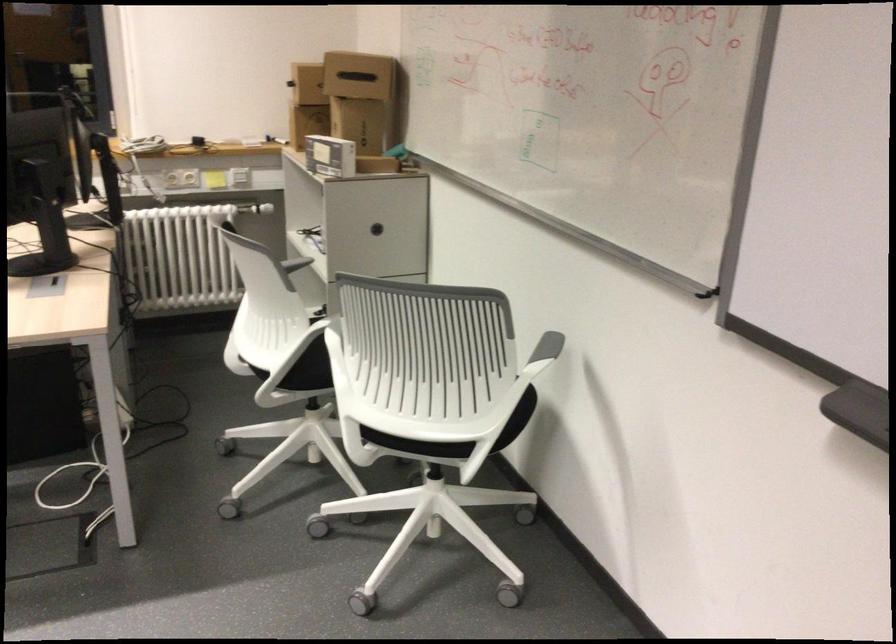
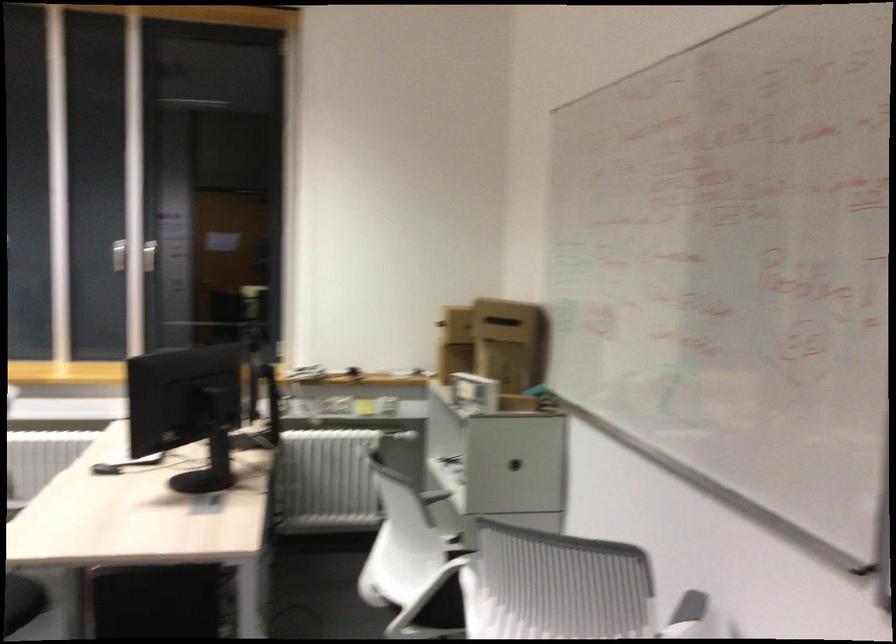
Which direction would the cameraman need to move to produce the second image?

The cameraman moved toward left, backward.